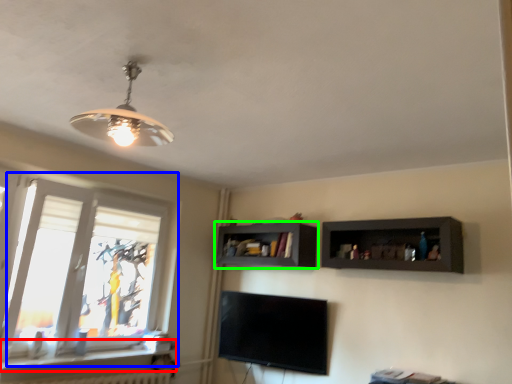
Question: Which object is the farthest from window sill (highlighted by a red box)? Choose among these: window (highlighted by a blue box) or shelf (highlighted by a green box).

Choices:
 (A) window
 (B) shelf

Answer: (B)